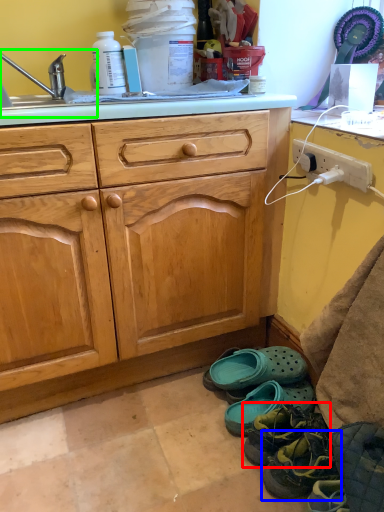
Question: Which object is positioned farthest from footwear (highlighted by a red box)? Select from footwear (highlighted by a blue box) and sink (highlighted by a green box).

Choices:
 (A) footwear
 (B) sink

Answer: (B)